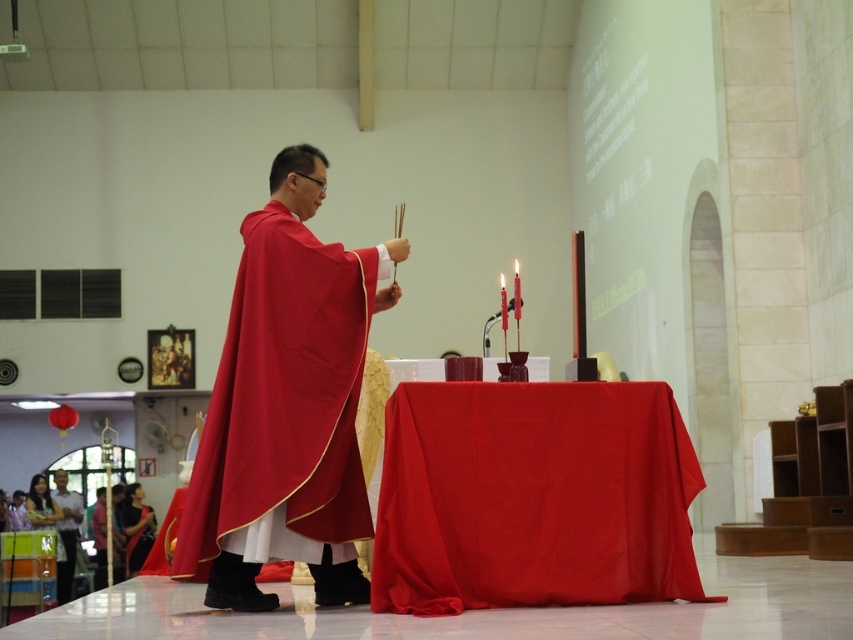
You are attending a religious ceremony and see two people wearing the smooth white shirt at lower left and the satin black dress at lower left. Which one is standing more to the left side?

The smooth white shirt at lower left is more to the left side than the satin black dress at lower left.

You are an event planner arranging the setup for a ceremony. You need to ensure that the red cloth table at center and the matte red cape at center are positioned so that the shorter object is placed in front to avoid blocking the view. Which object should be placed in front?

The red cloth table at center is not as tall as the matte red cape at center, so the red cloth table at center should be placed in front to avoid blocking the view.